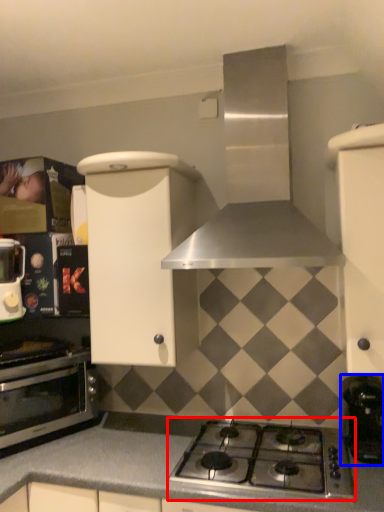
Question: Which of the following is the closest to the observer, gas stove (highlighted by a red box) or coffee machine (highlighted by a blue box)?

Choices:
 (A) gas stove
 (B) coffee machine

Answer: (A)